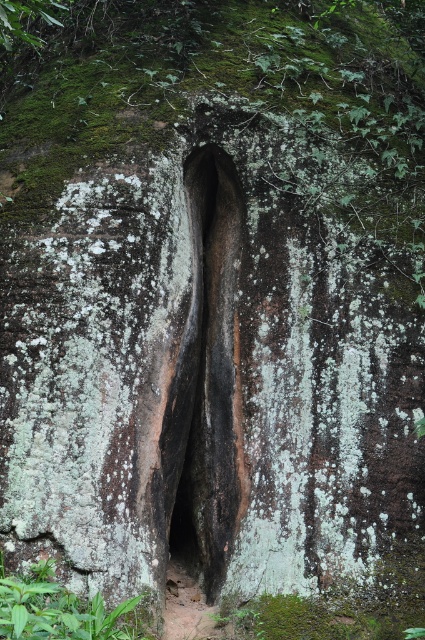
You are a hiker who wants to place a small marker at the base of the black rock cave at center. Where should you place it in relation to the green leafy plant at lower left?

The black rock cave at center is located above the green leafy plant at lower left, so you should place the marker below the green leafy plant at lower left.

You are an explorer trying to navigate through the black rock cave at center. You notice green mossy leaves at center above you. Which direction should you move to avoid the leaves?

The green mossy leaves at center are above the black rock cave at center, so to avoid them, you should move downward into the black rock cave at center.

You are a hiker trying to navigate through the rock formation. You notice green mossy leaves at center. Based on their position, can you determine if they are closer to the top or bottom of the crevice?

The green mossy leaves at center are located at point coordinates indicating they are closer to the bottom of the crevice since the crevice widens towards the bottom.